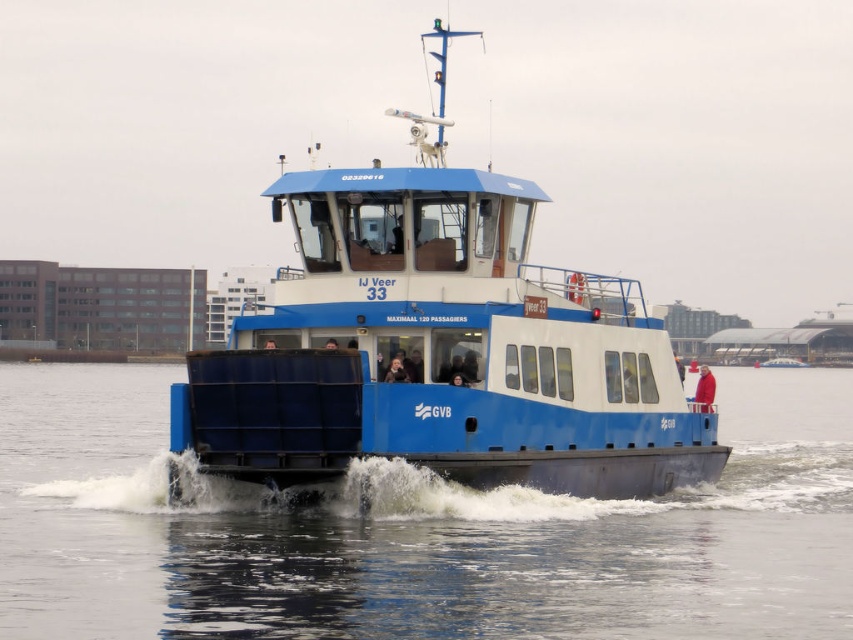
Can you confirm if blue metallic water at center is positioned above blue matte ferry at center?

No, blue metallic water at center is not above blue matte ferry at center.

Can you confirm if blue metallic water at center is positioned below blue matte ferry at center?

Indeed, blue metallic water at center is positioned under blue matte ferry at center.

Describe the element at coordinates (415, 531) in the screenshot. I see `blue metallic water at center` at that location.

Identify the location of blue metallic water at center. coord(415,531).

Is blue metallic water at center shorter than red woolen sweater at center?

No, blue metallic water at center is not shorter than red woolen sweater at center.

Does blue metallic water at center appear on the right side of red woolen sweater at center?

Incorrect, blue metallic water at center is not on the right side of red woolen sweater at center.

Does point (695, 605) lie behind point (706, 390)?

No, (695, 605) is in front of (706, 390).

Identify the location of blue metallic water at center. Image resolution: width=853 pixels, height=640 pixels. (415, 531).

Does blue matte ferry at center lie behind red woolen sweater at center?

No, blue matte ferry at center is in front of red woolen sweater at center.

Does blue matte ferry at center have a lesser height compared to red woolen sweater at center?

No, blue matte ferry at center is not shorter than red woolen sweater at center.

Where is `blue matte ferry at center`? blue matte ferry at center is located at coordinates (439, 349).